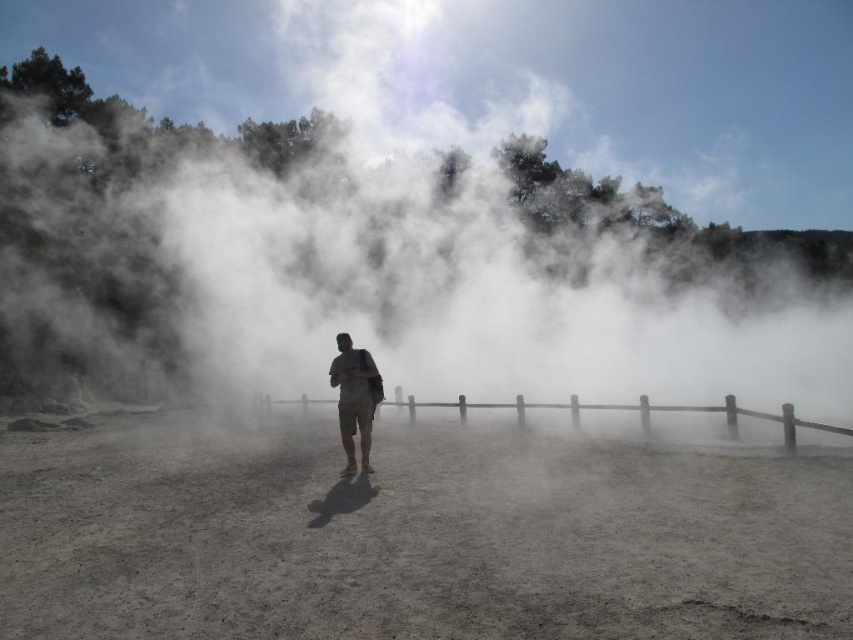
Question: Which object is farther from the camera taking this photo?

Choices:
 (A) brown wooden fence at center
 (B) tan cotton shorts at center

Answer: (B)

Question: Which of the following is the closest to the observer?

Choices:
 (A) brown wooden fence at center
 (B) tan cotton shorts at center

Answer: (A)

Question: Can you confirm if brown wooden fence at center is positioned to the left of tan cotton shorts at center?

Choices:
 (A) no
 (B) yes

Answer: (A)

Question: Can you confirm if brown wooden fence at center is smaller than tan cotton shorts at center?

Choices:
 (A) yes
 (B) no

Answer: (B)

Question: Does brown wooden fence at center appear on the left side of tan cotton shorts at center?

Choices:
 (A) no
 (B) yes

Answer: (A)

Question: Which point appears closest to the camera in this image?

Choices:
 (A) (457, 401)
 (B) (378, 378)

Answer: (B)